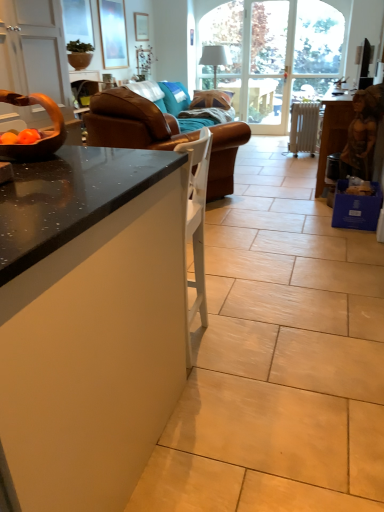
Question: Is point (339, 204) closer or farther from the camera than point (243, 35)?

Choices:
 (A) farther
 (B) closer

Answer: (B)

Question: Considering the positions of blue cardboard box at lower right and white glass screen door at center in the image, is blue cardboard box at lower right taller or shorter than white glass screen door at center?

Choices:
 (A) short
 (B) tall

Answer: (A)

Question: Based on their relative distances, which object is nearer to the matte glass picture frame at upper left, marked as the 2th picture frame in a back-to-front arrangement?

Choices:
 (A) black glossy desk at lower left
 (B) black glossy television at upper right
 (C) blue fabric pillow at center
 (D) white glass screen door at center
 (E) brown leather bowl at left

Answer: (C)

Question: Considering the real-world distances, which object is farthest from the blue fabric pillow at center?

Choices:
 (A) brown leather couch at center
 (B) blue cardboard box at lower right
 (C) white metallic radiator at right
 (D) wooden statue at right
 (E) matte glass picture frame at upper left, marked as the 2th picture frame in a back-to-front arrangement

Answer: (B)